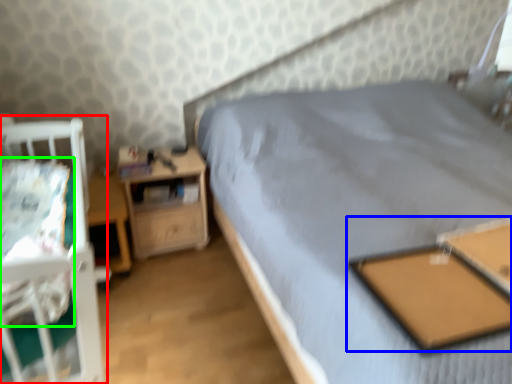
Question: Which object is positioned closest to infant bed (highlighted by a red box)? Select from table (highlighted by a blue box) and sheet (highlighted by a green box).

Choices:
 (A) table
 (B) sheet

Answer: (B)